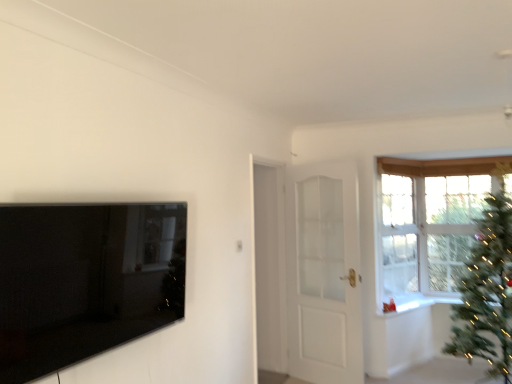
Question: Is black glossy tv at left outside of green matte christmas tree at right?

Choices:
 (A) no
 (B) yes

Answer: (B)

Question: Would you say black glossy tv at left contains green matte christmas tree at right?

Choices:
 (A) yes
 (B) no

Answer: (B)

Question: From a real-world perspective, is black glossy tv at left beneath green matte christmas tree at right?

Choices:
 (A) no
 (B) yes

Answer: (A)

Question: From a real-world perspective, is black glossy tv at left physically above green matte christmas tree at right?

Choices:
 (A) yes
 (B) no

Answer: (A)

Question: From the image's perspective, is black glossy tv at left below green matte christmas tree at right?

Choices:
 (A) no
 (B) yes

Answer: (A)

Question: Is black glossy tv at left next to green matte christmas tree at right?

Choices:
 (A) no
 (B) yes

Answer: (A)

Question: From a real-world perspective, is white glossy door at center located higher than clear glass window at upper right?

Choices:
 (A) yes
 (B) no

Answer: (B)

Question: Is white glossy door at center not within clear glass window at upper right?

Choices:
 (A) yes
 (B) no

Answer: (A)

Question: Is white glossy door at center to the right of clear glass window at upper right from the viewer's perspective?

Choices:
 (A) yes
 (B) no

Answer: (B)

Question: From a real-world perspective, is white glossy door at center located beneath clear glass window at upper right?

Choices:
 (A) yes
 (B) no

Answer: (A)

Question: Can you confirm if white glossy door at center is smaller than clear glass window at upper right?

Choices:
 (A) yes
 (B) no

Answer: (B)

Question: Is white glossy door at center shorter than clear glass window at upper right?

Choices:
 (A) no
 (B) yes

Answer: (A)

Question: Is green matte christmas tree at right looking in the opposite direction of clear glass window at upper right?

Choices:
 (A) no
 (B) yes

Answer: (A)